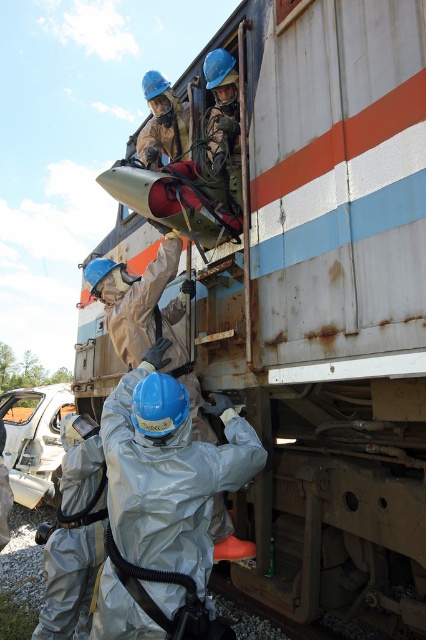
You are a bystander observing the rescue operation. You notice two helmets at the upper center of the scene. Which helmet is closer to you, the matte black helmet at upper center or the matte blue helmet at upper center?

The matte black helmet at upper center is closer to you because it is in front of the matte blue helmet at upper center.